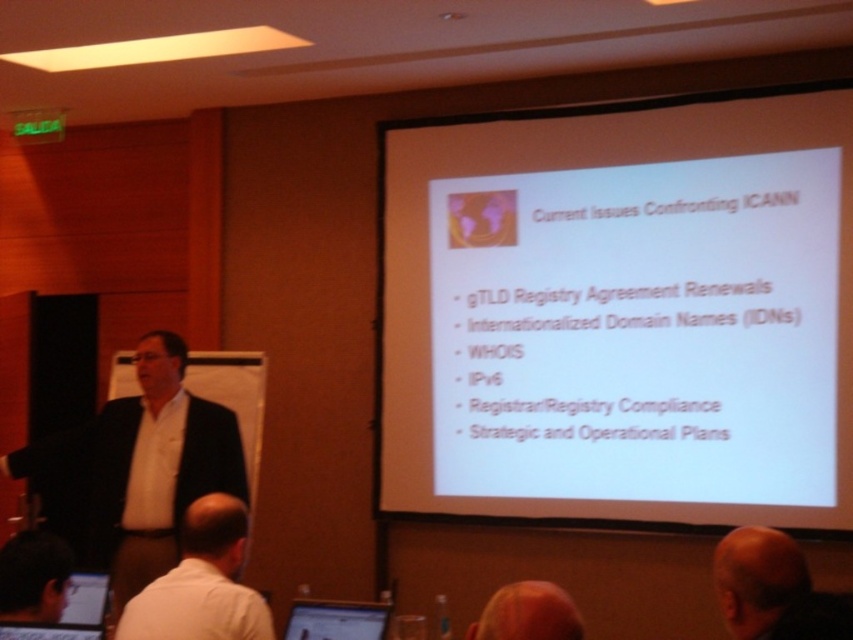
You are an attendee at the presentation and you want to take a photo of the slide on the screen. You have your matte black laptop at lower center and a white shirt at left in your view. Which object is closer to the left edge of your camera frame?

The white shirt at left is closer to the left edge of your camera frame because it is positioned on the left side of the matte black laptop at lower center.

You are an event organizer standing at the front of the room. You notice a bald head at lower right and brown hair at upper center in the audience. You want to ensure that both attendees can clearly see the projection screen. Considering their positions, which attendee is closer to the screen?

The bald head at lower right is 7.94 feet from brown hair at upper center. Since the brown hair at upper center is closer to the screen than the bald head at lower right, the attendee with brown hair at upper center is closer to the screen.